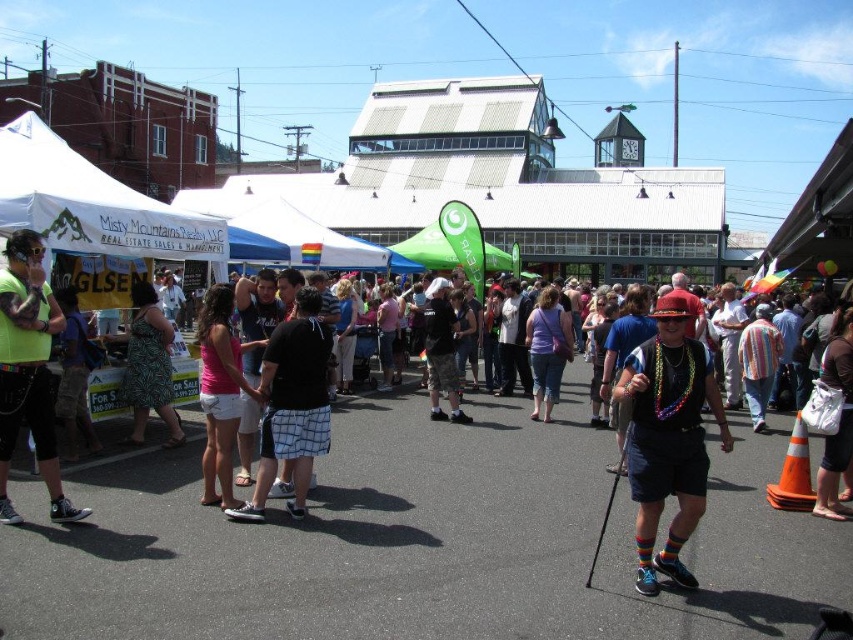
In the scene shown: You are a photographer standing at the edge of the market. You notice two people in the crowd wearing pink fabric shorts at center and green printed dress at center. Which person should you focus on first if you want to take a photo of the one closer to you?

The pink fabric shorts at center is closer to the viewer, so you should focus on the person wearing pink fabric shorts at center first.

In the lively outdoor market scene, there are two items of clothing visible. The rainbow striped socks at center and the matte neon green shirt at left. From the perspective of someone standing in the market, which clothing item is positioned to the right of the other?

The rainbow striped socks at center are positioned to the right of the matte neon green shirt at left.